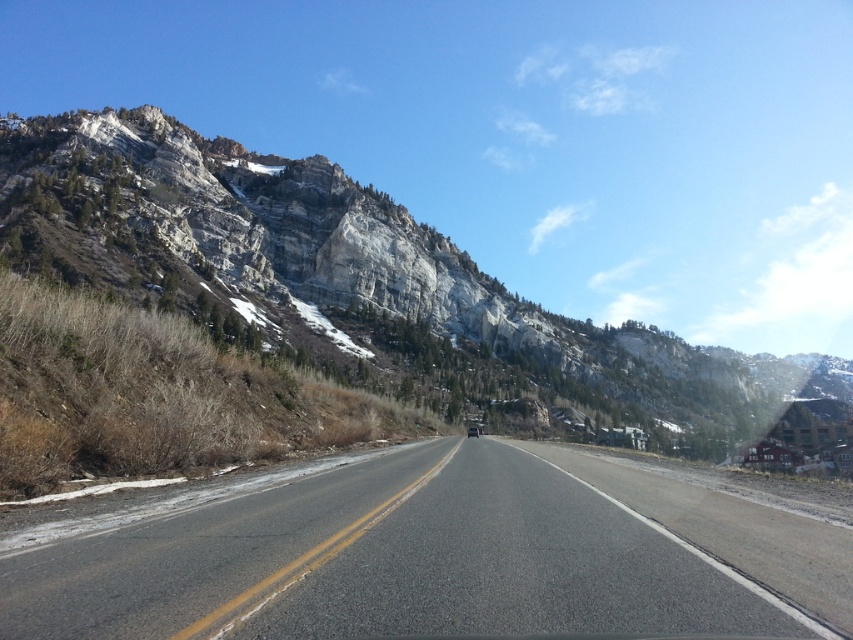
Question: Does asphalt road at center have a greater width compared to rocky cliff at upper left?

Choices:
 (A) no
 (B) yes

Answer: (A)

Question: Among these points, which one is farthest from the camera?

Choices:
 (A) (73, 620)
 (B) (96, 164)

Answer: (B)

Question: Does asphalt road at center have a greater width compared to rocky cliff at upper left?

Choices:
 (A) yes
 (B) no

Answer: (B)

Question: Which point is farther from the camera taking this photo?

Choices:
 (A) pos(380,522)
 (B) pos(292,189)

Answer: (B)

Question: Is asphalt road at center smaller than rocky cliff at upper left?

Choices:
 (A) yes
 (B) no

Answer: (A)

Question: Which object appears closest to the camera in this image?

Choices:
 (A) rocky cliff at upper left
 (B) asphalt road at center

Answer: (B)